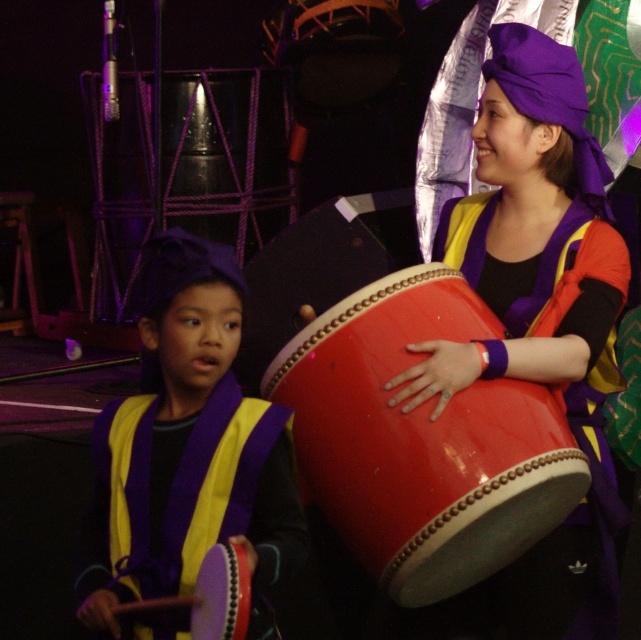
You are a stagehand preparing to move the drums. The shiny purple drum at center and the shiny red drum at center are stacked. Which drum should you lift first to access the other?

The shiny purple drum at center should be lifted first since it is positioned over the shiny red drum at center, meaning the red one is underneath.